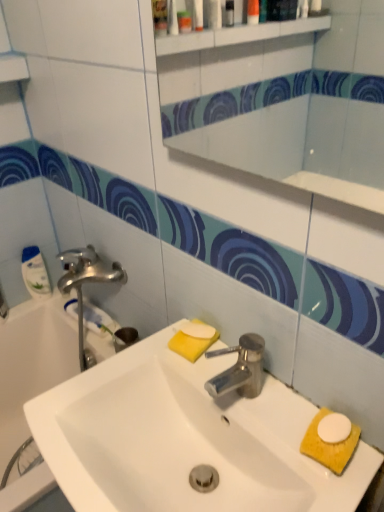
The height and width of the screenshot is (512, 384). What do you see at coordinates (198, 330) in the screenshot?
I see `white matte soap at center` at bounding box center [198, 330].

This screenshot has height=512, width=384. Describe the element at coordinates (35, 273) in the screenshot. I see `white glossy bottle at left` at that location.

Identify the location of white matte soap at center. (198, 330).

Considering the sizes of objects yellow sponge at lower right and white glossy sink at center in the image provided, who is wider, yellow sponge at lower right or white glossy sink at center?

With larger width is white glossy sink at center.

From a real-world perspective, is yellow sponge at lower right above or below white glossy sink at center?

Clearly, from a real-world perspective, yellow sponge at lower right is above white glossy sink at center.

Based on the photo, is yellow sponge at lower right at the right side of white glossy sink at center?

Indeed, yellow sponge at lower right is positioned on the right side of white glossy sink at center.

Between yellow sponge at lower right and white glossy sink at center, which one has smaller size?

yellow sponge at lower right is smaller.

Would you say white glossy bottle at left is part of yellow sponge at lower right's contents?

No, white glossy bottle at left is located outside of yellow sponge at lower right.

Identify the location of cleaning product that is on the left side of yellow sponge at lower right. The height and width of the screenshot is (512, 384). (35, 273).

From a real-world perspective, which is physically below, yellow sponge at lower right or white glossy bottle at left?

In real-world perspective, white glossy bottle at left is lower.

Can you confirm if yellow sponge at lower right is thinner than white glossy bottle at left?

Incorrect, the width of yellow sponge at lower right is not less than that of white glossy bottle at left.

Could you tell me if white glossy bathtub at left is facing white glossy bottle at left?

No, white glossy bathtub at left is not turned towards white glossy bottle at left.

Considering the relative sizes of white glossy bathtub at left and white glossy bottle at left in the image provided, is white glossy bathtub at left shorter than white glossy bottle at left?

No, white glossy bathtub at left is not shorter than white glossy bottle at left.

From a real-world perspective, is white glossy bathtub at left physically located above or below white glossy bottle at left?

From a real-world perspective, white glossy bathtub at left is physically below white glossy bottle at left.

Can you confirm if white glossy bathtub at left is thinner than white glossy bottle at left?

In fact, white glossy bathtub at left might be wider than white glossy bottle at left.

Does white glossy mirror at upper center have a greater height compared to white glossy sink at center?

Yes, white glossy mirror at upper center is taller than white glossy sink at center.

Is white glossy mirror at upper center placed right next to white glossy sink at center?

white glossy mirror at upper center and white glossy sink at center are not in contact.

From a real-world perspective, is white glossy mirror at upper center beneath white glossy sink at center?

No, from a real-world perspective, white glossy mirror at upper center is not under white glossy sink at center.

From a real-world perspective, does white glossy mirror at upper center sit lower than yellow sponge at lower right?

No, from a real-world perspective, white glossy mirror at upper center is not below yellow sponge at lower right.

In terms of width, does white glossy mirror at upper center look wider or thinner when compared to yellow sponge at lower right?

In the image, white glossy mirror at upper center appears to be more narrow than yellow sponge at lower right.

Identify the location of mirror above the yellow sponge at lower right (from the image's perspective). pyautogui.click(x=297, y=131).

Which is closer to the camera, (24, 256) or (195, 334)?

Point (24, 256) is positioned farther from the camera compared to point (195, 334).

From a real-world perspective, does white glossy bottle at left stand above white matte soap at center?

Actually, white glossy bottle at left is physically below white matte soap at center in the real world.

Considering the positions of objects white glossy bottle at left and white matte soap at center in the image provided, who is more to the left, white glossy bottle at left or white matte soap at center?

Positioned to the left is white glossy bottle at left.

Which of these two, white glossy bathtub at left or yellow sponge at lower right, stands taller?

white glossy bathtub at left is taller.

From the image's perspective, is white glossy bathtub at left located above or below yellow sponge at lower right?

white glossy bathtub at left is situated lower than yellow sponge at lower right in the image.

Is white glossy bathtub at left next to yellow sponge at lower right?

No, white glossy bathtub at left is not beside yellow sponge at lower right.

Is yellow sponge at lower right a part of white glossy bathtub at left?

No.

The height and width of the screenshot is (512, 384). I want to click on hand towel behind the white glossy sink at center, so click(329, 445).

This screenshot has height=512, width=384. What are the coordinates of `hand towel in front of the white glossy bottle at left` in the screenshot? It's located at (329, 445).

Looking at the image, which one is located further to white matte soap at center, white glossy bottle at left or yellow sponge at lower right?

Among the two, white glossy bottle at left is located further to white matte soap at center.

Which object lies nearer to the anchor point yellow sponge at lower right, white glossy bottle at left or white glossy sink at center?

Based on the image, white glossy sink at center appears to be nearer to yellow sponge at lower right.

Looking at the image, which one is located further to white glossy bottle at left, yellow sponge at lower right or white glossy mirror at upper center?

white glossy mirror at upper center lies further to white glossy bottle at left than the other object.

From the image, which object appears to be farther from yellow sponge at lower right, white matte soap at center or white glossy sink at center?

white matte soap at center is positioned further to the anchor yellow sponge at lower right.

When comparing their distances from white glossy sink at center, does yellow sponge at lower right or white glossy bathtub at left seem closer?

The object closer to white glossy sink at center is yellow sponge at lower right.

Considering their positions, is white matte soap at center positioned closer to white glossy bottle at left than white glossy bathtub at left?

white glossy bathtub at left lies closer to white glossy bottle at left than the other object.

Considering their positions, is white glossy bottle at left positioned further to white glossy bathtub at left than yellow sponge at lower right?

yellow sponge at lower right is positioned further to the anchor white glossy bathtub at left.

Based on their spatial positions, is white glossy bottle at left or white glossy bathtub at left closer to white glossy sink at center?

white glossy bathtub at left lies closer to white glossy sink at center than the other object.

Where is `bathtub between white glossy bottle at left and yellow sponge at lower right from left to right`? This screenshot has height=512, width=384. bathtub between white glossy bottle at left and yellow sponge at lower right from left to right is located at coordinates (43, 371).

Where is `soap positioned between white glossy mirror at upper center and white glossy bottle at left from near to far`? The width and height of the screenshot is (384, 512). soap positioned between white glossy mirror at upper center and white glossy bottle at left from near to far is located at coordinates (198, 330).

This screenshot has height=512, width=384. What are the coordinates of `bathtub between white glossy mirror at upper center and white glossy sink at center from top to bottom` in the screenshot? It's located at (43, 371).

The height and width of the screenshot is (512, 384). I want to click on soap between white glossy sink at center and white glossy bottle at left along the z-axis, so click(x=198, y=330).